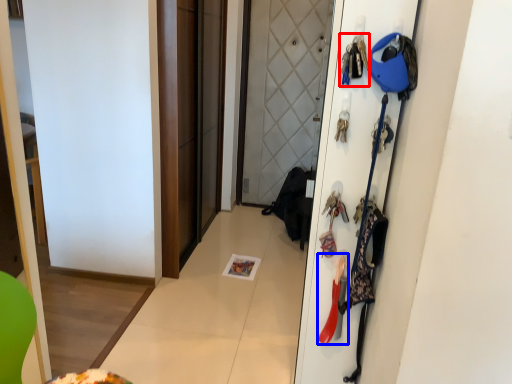
Question: Among these objects, which one is farthest to the camera, accessory (highlighted by a red box) or accessory (highlighted by a blue box)?

Choices:
 (A) accessory
 (B) accessory

Answer: (B)